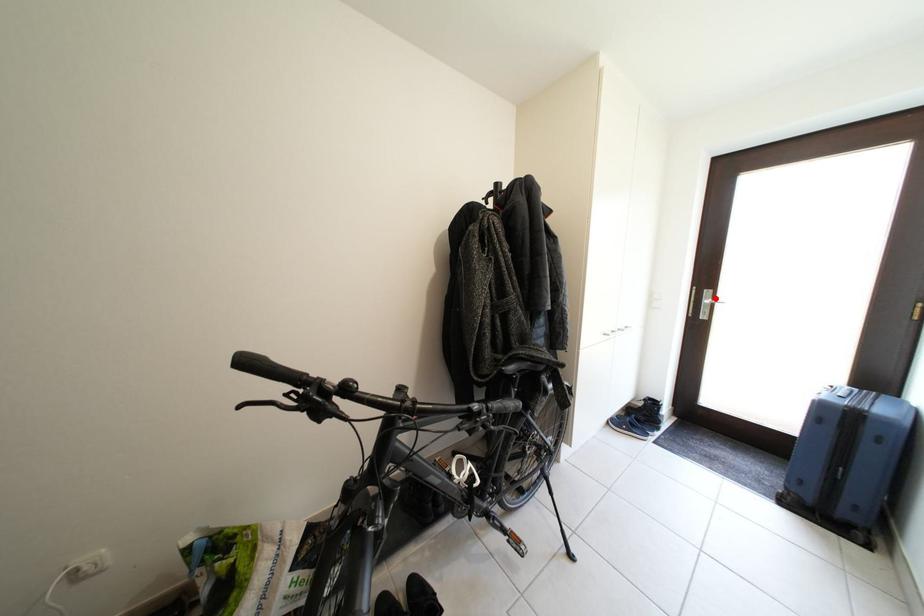
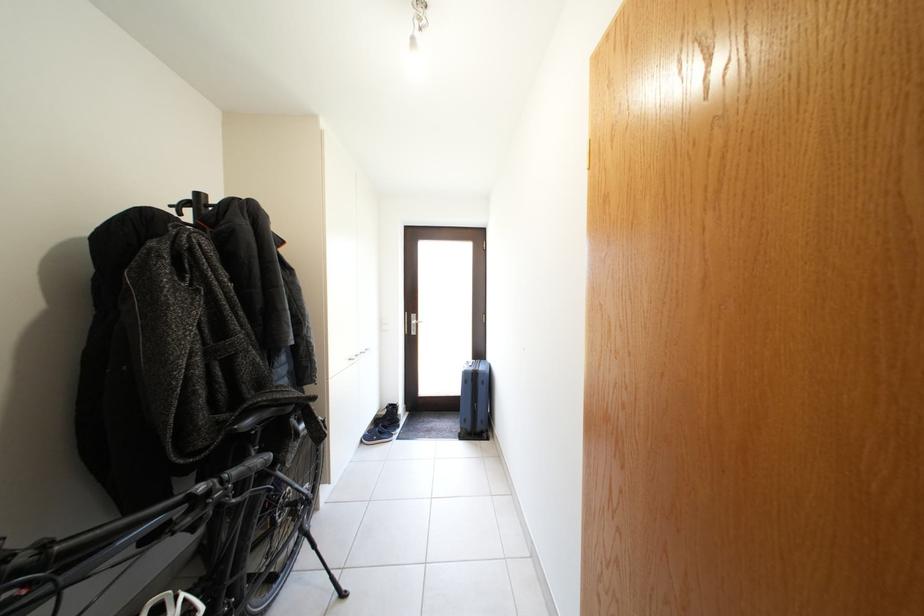
Find the pixel in the second image that matches the highlighted location in the first image.

(421, 322)